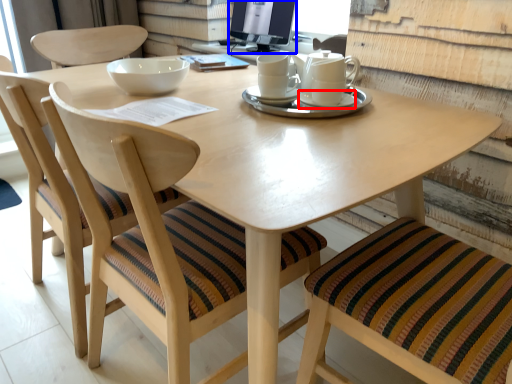
Question: Which point is further to the camera, saucer (highlighted by a red box) or computer monitor (highlighted by a blue box)?

Choices:
 (A) saucer
 (B) computer monitor

Answer: (B)